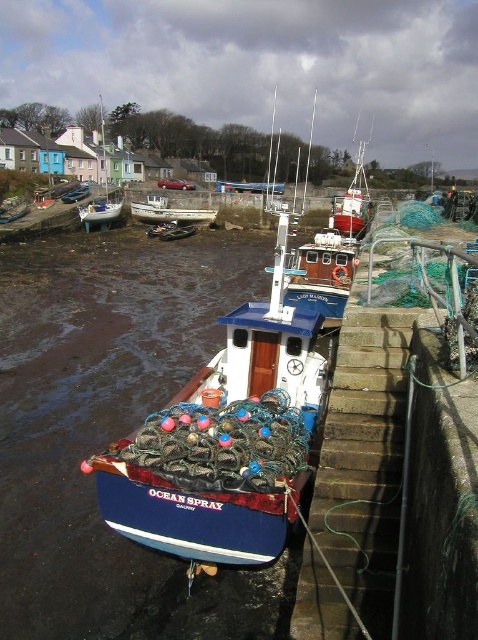
Question: Does white wooden boat at upper left appear on the right side of blue painted wooden boat at lower left?

Choices:
 (A) yes
 (B) no

Answer: (B)

Question: Does white wooden boat at upper left appear over blue painted wooden boat at lower left?

Choices:
 (A) yes
 (B) no

Answer: (A)

Question: Which of the following is the farthest from the observer?

Choices:
 (A) white wooden boat at center
 (B) blue painted wooden boat at lower left
 (C) blue matte fishing boat at center
 (D) white wooden boat at upper left

Answer: (A)

Question: Is blue matte fishing boat at center thinner than white wooden boat at center?

Choices:
 (A) yes
 (B) no

Answer: (A)

Question: Among these objects, which one is nearest to the camera?

Choices:
 (A) white wooden boat at center
 (B) white wooden boat at upper left
 (C) blue matte fishing boat at center
 (D) blue painted wooden boat at lower left

Answer: (C)

Question: Which object is the closest to the white wooden boat at center?

Choices:
 (A) blue matte fishing boat at center
 (B) blue painted wooden boat at lower left

Answer: (B)